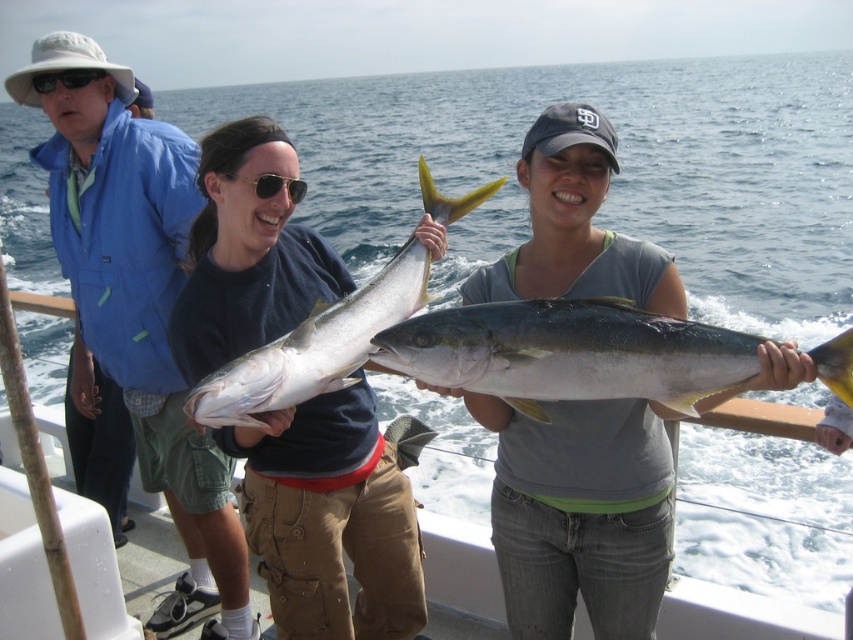
Can you confirm if yellow shiny fish at center is shorter than black plastic sunglasses at upper left?

No.

Can you confirm if yellow shiny fish at center is wider than black plastic sunglasses at upper left?

Yes, yellow shiny fish at center is wider than black plastic sunglasses at upper left.

Locate an element on the screen. This screenshot has width=853, height=640. yellow shiny fish at center is located at coordinates (569, 353).

Is gray cotton t-shirt at center closer to camera compared to black plastic sunglasses at upper left?

That is True.

Find the location of a particular element. The height and width of the screenshot is (640, 853). gray cotton t-shirt at center is located at coordinates (579, 515).

Is yellowish metallic fish at center taller than black plastic sunglasses at upper left?

Yes, yellowish metallic fish at center is taller than black plastic sunglasses at upper left.

Which of these two, yellowish metallic fish at center or black plastic sunglasses at upper left, stands shorter?

With less height is black plastic sunglasses at upper left.

Does point (262, 400) come in front of point (80, 84)?

Yes, it is.

Find the location of a particular element. Image resolution: width=853 pixels, height=640 pixels. yellowish metallic fish at center is located at coordinates (314, 348).